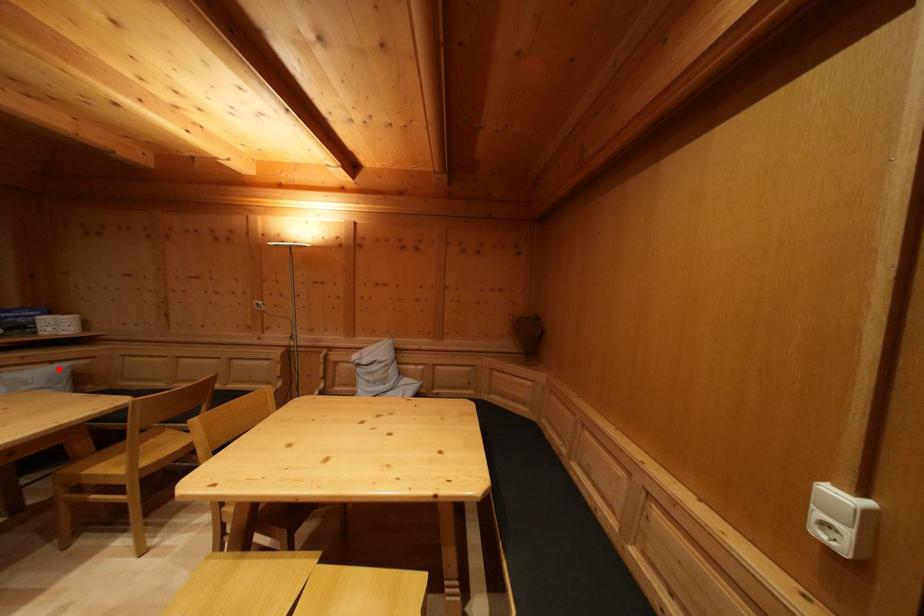
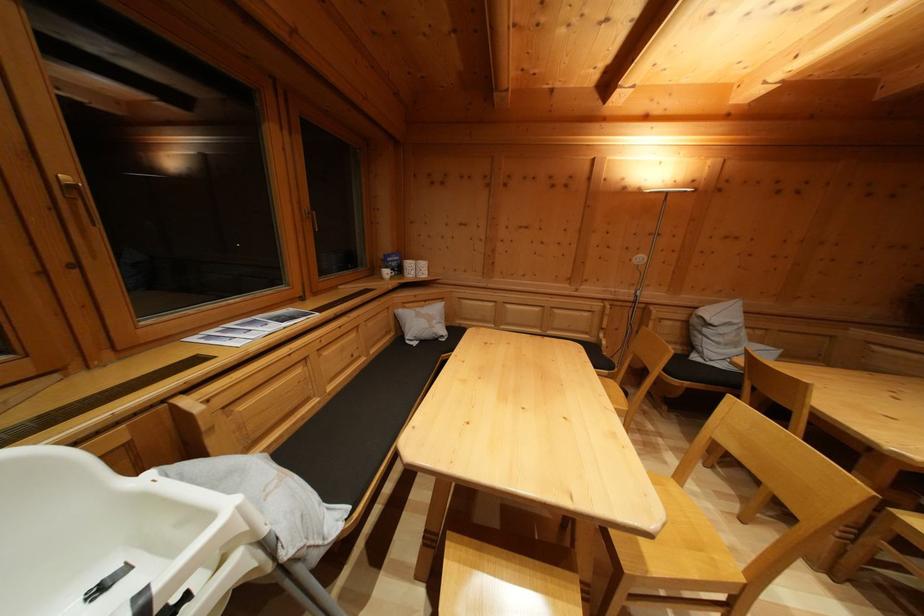
Where in the second image is the point corresponding to the highlighted location from the first image?

(431, 308)